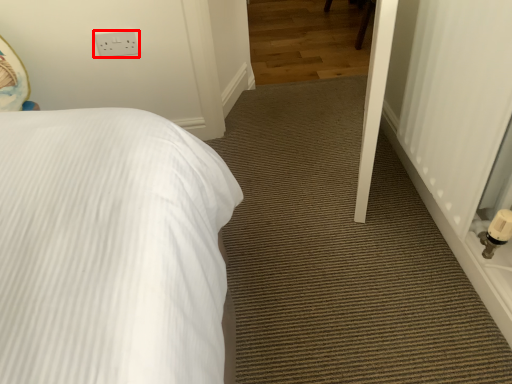
Question: From the image's perspective, considering the relative positions of electric outlet (annotated by the red box) and screen door in the image provided, where is electric outlet (annotated by the red box) located with respect to the staircase?

Choices:
 (A) below
 (B) above

Answer: (B)